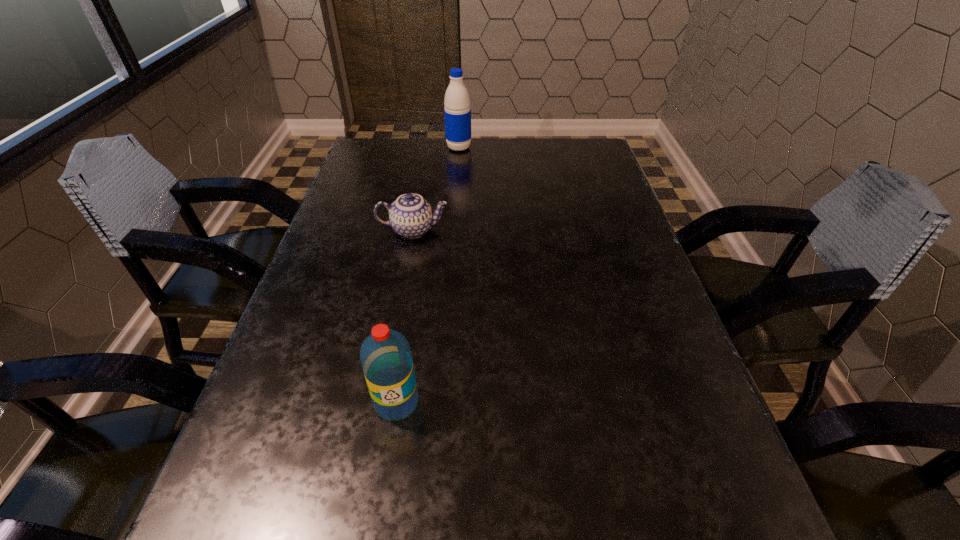
This screenshot has height=540, width=960. In order to click on free space between the taller water bottle and the chinaware in this screenshot , I will do `click(436, 189)`.

This screenshot has width=960, height=540. What are the coordinates of `free spot between the shortest object and the second shortest object` in the screenshot? It's located at (405, 316).

Locate an element on the screen. The width and height of the screenshot is (960, 540). empty space that is in between the shortest object and the nearest object is located at coordinates (405, 316).

At what (x,y) coordinates should I click in order to perform the action: click on vacant space in between the tallest object and the nearest object. Please return your answer as a coordinate pair (x, y). The image size is (960, 540). Looking at the image, I should click on (428, 275).

You are a GUI agent. You are given a task and a screenshot of the screen. Output one action in this format:
    pyautogui.click(x=<x>, y=<y>)
    Task: Click on the free point between the tallest object and the chinaware
    The width and height of the screenshot is (960, 540).
    Given the screenshot: What is the action you would take?
    pyautogui.click(x=436, y=189)

Identify which object is located as the nearest to the taller water bottle. Please provide its 2D coordinates. Your answer should be formatted as a tuple, i.e. [(x, y)], where the tuple contains the x and y coordinates of a point satisfying the conditions above.

[(411, 216)]

I want to click on object that stands as the second closest to the nearer water bottle, so click(x=457, y=111).

You are a GUI agent. You are given a task and a screenshot of the screen. Output one action in this format:
    pyautogui.click(x=<x>, y=<y>)
    Task: Click on the vacant area in the image that satisfies the following two spatial constraints: 1. on the front side of the taller water bottle; 2. from the spout of the shortest object
    This screenshot has height=540, width=960.
    Given the screenshot: What is the action you would take?
    pyautogui.click(x=453, y=230)